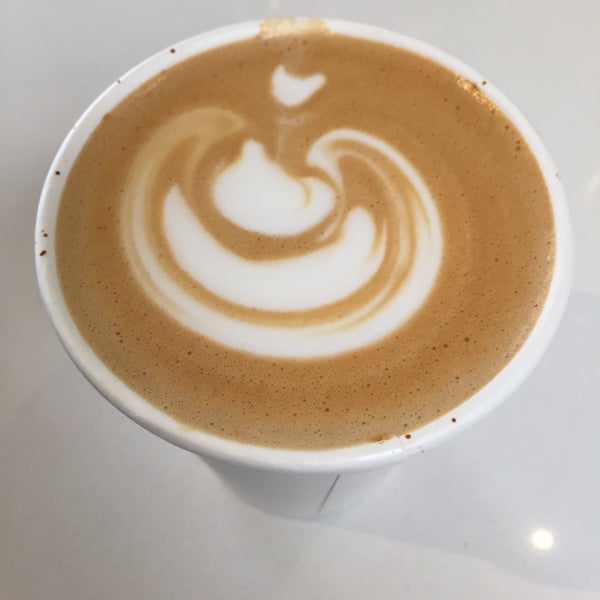
Locate an element on the screen. paper cup is located at coordinates (293, 490), (438, 434).